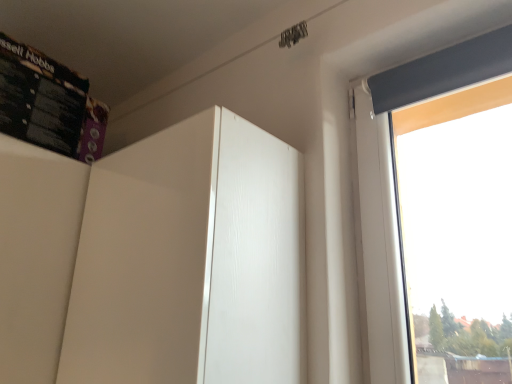
What are the coordinates of `black cardboard box at upper left` in the screenshot? It's located at (40, 98).

The width and height of the screenshot is (512, 384). What do you see at coordinates (40, 98) in the screenshot?
I see `black cardboard box at upper left` at bounding box center [40, 98].

The image size is (512, 384). Identify the location of white glossy cabinet at center. (190, 260).

The width and height of the screenshot is (512, 384). Describe the element at coordinates (190, 260) in the screenshot. I see `white glossy cabinet at center` at that location.

Where is `black cardboard box at upper left`? This screenshot has width=512, height=384. black cardboard box at upper left is located at coordinates pyautogui.click(x=40, y=98).

Considering the positions of objects white glossy cabinet at center and black cardboard box at upper left in the image provided, who is more to the right, white glossy cabinet at center or black cardboard box at upper left?

Positioned to the right is white glossy cabinet at center.

Is the depth of white glossy cabinet at center greater than that of black cardboard box at upper left?

No, white glossy cabinet at center is in front of black cardboard box at upper left.

Which is behind, point (143, 223) or point (50, 67)?

Point (50, 67)

From the image's perspective, which object appears higher, white glossy cabinet at center or black cardboard box at upper left?

black cardboard box at upper left, from the image's perspective.

From a real-world perspective, is white glossy cabinet at center located higher than black cardboard box at upper left?

No, from a real-world perspective, white glossy cabinet at center is not above black cardboard box at upper left.

Does white glossy cabinet at center have a greater width compared to black cardboard box at upper left?

In fact, white glossy cabinet at center might be narrower than black cardboard box at upper left.

Which of these two, white glossy cabinet at center or black cardboard box at upper left, stands shorter?

Standing shorter between the two is black cardboard box at upper left.

Based on the photo, can you confirm if white glossy cabinet at center is smaller than black cardboard box at upper left?

No.

Can black cardboard box at upper left be found inside white glossy cabinet at center?

No, black cardboard box at upper left is located outside of white glossy cabinet at center.

Does white glossy cabinet at center touch black cardboard box at upper left?

white glossy cabinet at center is not next to black cardboard box at upper left, and they're not touching.

Is white glossy cabinet at center aimed at black cardboard box at upper left?

No, white glossy cabinet at center does not turn towards black cardboard box at upper left.

Can you tell me how much white glossy cabinet at center and black cardboard box at upper left differ in facing direction?

white glossy cabinet at center and black cardboard box at upper left are facing 0.946 degrees away from each other.

Locate an element on the screen. The image size is (512, 384). screen door that is on the right side of black cardboard box at upper left is located at coordinates (190, 260).

Which is more to the right, black cardboard box at upper left or white glossy cabinet at center?

From the viewer's perspective, white glossy cabinet at center appears more on the right side.

Is the depth of black cardboard box at upper left less than that of white glossy cabinet at center?

No, black cardboard box at upper left is behind white glossy cabinet at center.

Which point is more forward, (x=71, y=104) or (x=278, y=281)?

Positioned in front is point (x=278, y=281).

From the image's perspective, between black cardboard box at upper left and white glossy cabinet at center, who is located below?

white glossy cabinet at center, from the image's perspective.

From a real-world perspective, is black cardboard box at upper left physically below white glossy cabinet at center?

Actually, black cardboard box at upper left is physically above white glossy cabinet at center in the real world.

Considering the sizes of black cardboard box at upper left and white glossy cabinet at center in the image, is black cardboard box at upper left wider or thinner than white glossy cabinet at center?

black cardboard box at upper left is wider than white glossy cabinet at center.

Does black cardboard box at upper left have a lesser height compared to white glossy cabinet at center?

Yes, black cardboard box at upper left is shorter than white glossy cabinet at center.

Who is bigger, black cardboard box at upper left or white glossy cabinet at center?

white glossy cabinet at center is bigger.

Is black cardboard box at upper left situated inside white glossy cabinet at center or outside?

black cardboard box at upper left is not enclosed by white glossy cabinet at center.

Would you consider black cardboard box at upper left to be distant from white glossy cabinet at center?

black cardboard box at upper left is actually quite close to white glossy cabinet at center.

Is black cardboard box at upper left positioned with its back to white glossy cabinet at center?

No, black cardboard box at upper left is not facing away from white glossy cabinet at center.

How distant is black cardboard box at upper left from white glossy cabinet at center?

black cardboard box at upper left and white glossy cabinet at center are 17.29 inches apart from each other.

You are a GUI agent. You are given a task and a screenshot of the screen. Output one action in this format:
    pyautogui.click(x=<x>, y=<y>)
    Task: Click on the bulletin board lying behind the white glossy cabinet at center
    The height and width of the screenshot is (384, 512).
    Given the screenshot: What is the action you would take?
    pyautogui.click(x=40, y=98)

You are a GUI agent. You are given a task and a screenshot of the screen. Output one action in this format:
    pyautogui.click(x=<x>, y=<y>)
    Task: Click on the bulletin board that appears above the white glossy cabinet at center (from the image's perspective)
    
    Given the screenshot: What is the action you would take?
    click(x=40, y=98)

At what (x,y) coordinates should I click in order to perform the action: click on screen door in front of the black cardboard box at upper left. Please return your answer as a coordinate pair (x, y). Looking at the image, I should click on (190, 260).